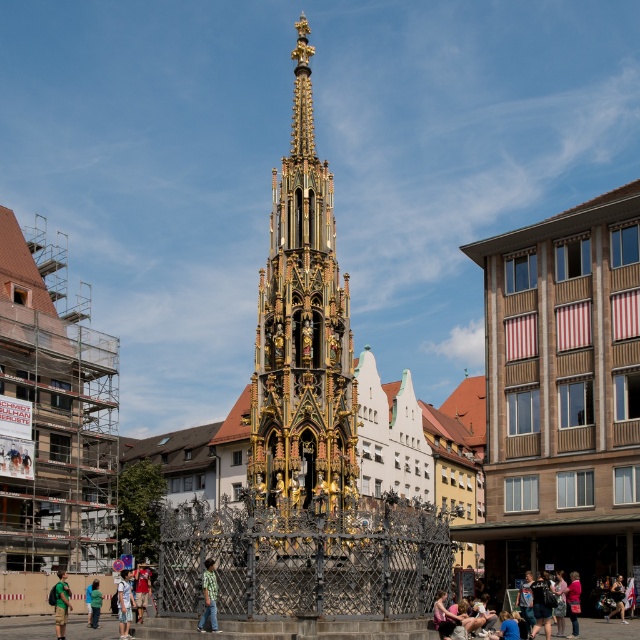
You are standing in the town square and see the golden ornate tower at center and the green fabric shirt at lower left. Which object is closer to you?

The golden ornate tower at center is closer to you because the green fabric shirt at lower left is behind it.

You are a tailor who needs to determine which clothing item has a greater width to accommodate a client. You see the denim shorts at lower center and the green fabric jacket at lower left. Which one has a larger width?

The denim shorts at lower center has a larger width than the green fabric jacket at lower left according to the description.

You are a tourist standing in front of the Gothic fountain and want to take a photo of the green fabric jacket at lower left and denim shorts at lower center. Can you see both objects clearly in the photo?

The green fabric jacket at lower left is behind denim shorts at lower center, so the denim shorts may block part of the green fabric jacket at lower left in the photo.